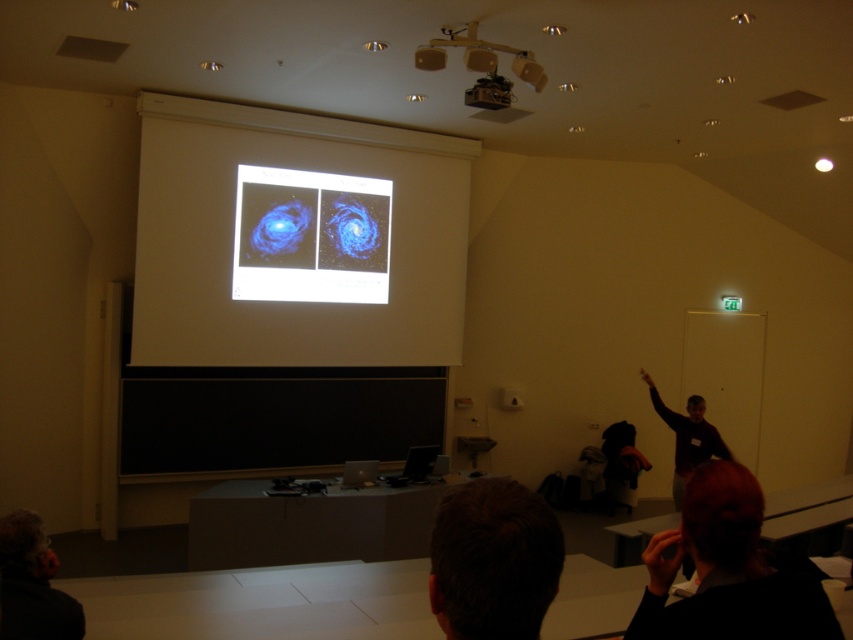
You are sitting in the audience facing the projection screen. There are two points marked in the scene. The first point is at coordinates point (308,224) and the second point is at point (73,602). Which point is closer to you?

Point (308,224) is further to the viewer than point (73,602), so the second point is closer to you.